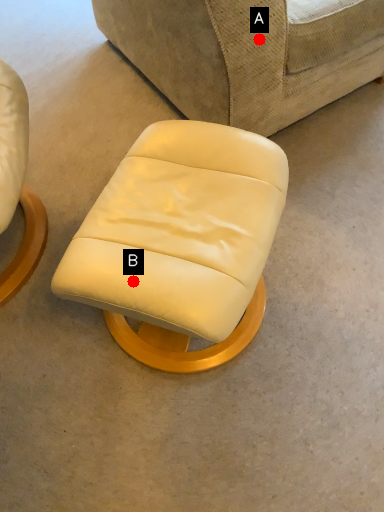
Question: Two points are circled on the image, labeled by A and B beside each circle. Which of the following is the farthest from the observer?

Choices:
 (A) A is further
 (B) B is further

Answer: (A)